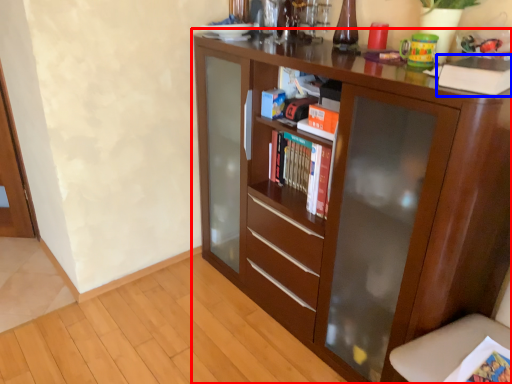
Question: Among these objects, which one is nearest to the camera, cupboard (highlighted by a red box) or paperback book (highlighted by a blue box)?

Choices:
 (A) cupboard
 (B) paperback book

Answer: (A)